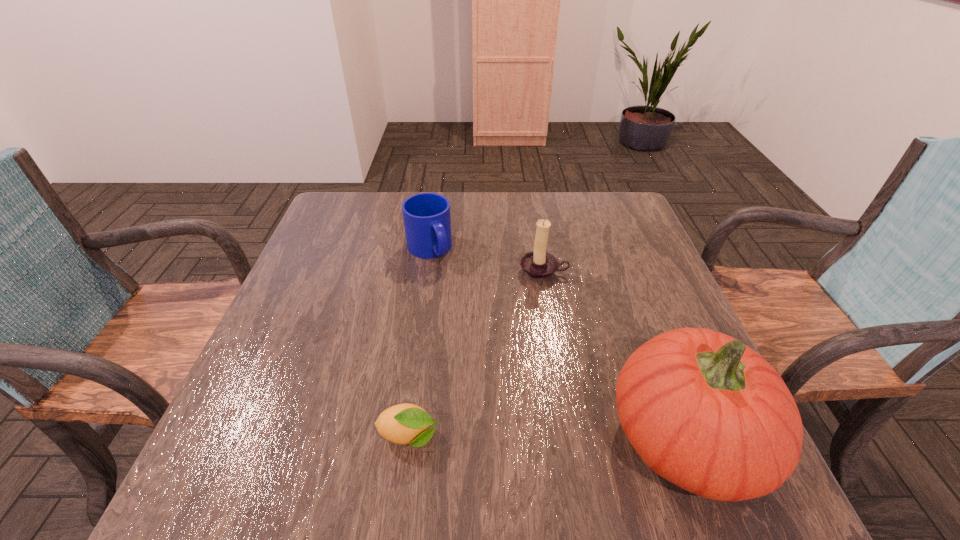
This screenshot has height=540, width=960. I want to click on lemon, so click(x=406, y=423).

Where is `the rightmost object`? The height and width of the screenshot is (540, 960). the rightmost object is located at coordinates (703, 410).

This screenshot has width=960, height=540. Find the location of `pumpkin`. pumpkin is located at coordinates (703, 410).

In order to click on the second shortest object in this screenshot , I will do `click(427, 221)`.

At what (x,y) coordinates should I click in order to perform the action: click on candle holder. Please return your answer as a coordinate pair (x, y). The width and height of the screenshot is (960, 540). Looking at the image, I should click on (538, 265).

At what (x,y) coordinates should I click in order to perform the action: click on the second tallest object. Please return your answer as a coordinate pair (x, y). The width and height of the screenshot is (960, 540). Looking at the image, I should click on (538, 265).

Locate an element on the screen. The image size is (960, 540). vacant area situated 0.130m with leaves positioned above the shortest object is located at coordinates (516, 437).

At what (x,y) coordinates should I click in order to perform the action: click on free space located on the left of the pumpkin. Please return your answer as a coordinate pair (x, y). Looking at the image, I should click on (471, 436).

At what (x,y) coordinates should I click in order to perform the action: click on free region located on the side with the handle of the third tallest object. Please return your answer as a coordinate pair (x, y). Image resolution: width=960 pixels, height=540 pixels. Looking at the image, I should click on click(498, 360).

Identify the location of blank area located on the side with the handle of the third tallest object. (481, 333).